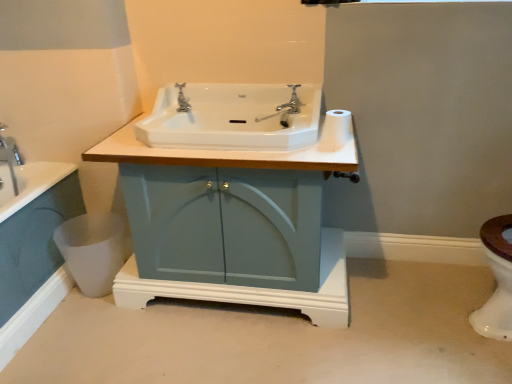
Question: Considering their positions, is white glossy toilet bowl at lower right located in front of or behind silver metallic faucet at center?

Choices:
 (A) front
 (B) behind

Answer: (A)

Question: Considering the positions of white glossy toilet bowl at lower right and silver metallic faucet at center in the image, is white glossy toilet bowl at lower right taller or shorter than silver metallic faucet at center?

Choices:
 (A) tall
 (B) short

Answer: (A)

Question: Estimate the real-world distances between objects in this image. Which object is farther from the white glossy sink at center?

Choices:
 (A) matte blue cabinet at center
 (B) silver metallic faucet at center
 (C) white glossy toilet bowl at lower right
 (D) chrome metallic faucet at upper center
 (E) white matte toilet paper at upper right

Answer: (C)

Question: Estimate the real-world distances between objects in this image. Which object is farther from the silver metallic faucet at center?

Choices:
 (A) white matte toilet paper at upper right
 (B) matte blue cabinet at center
 (C) chrome metallic faucet at upper center
 (D) white glossy sink at center
 (E) white glossy toilet bowl at lower right

Answer: (B)